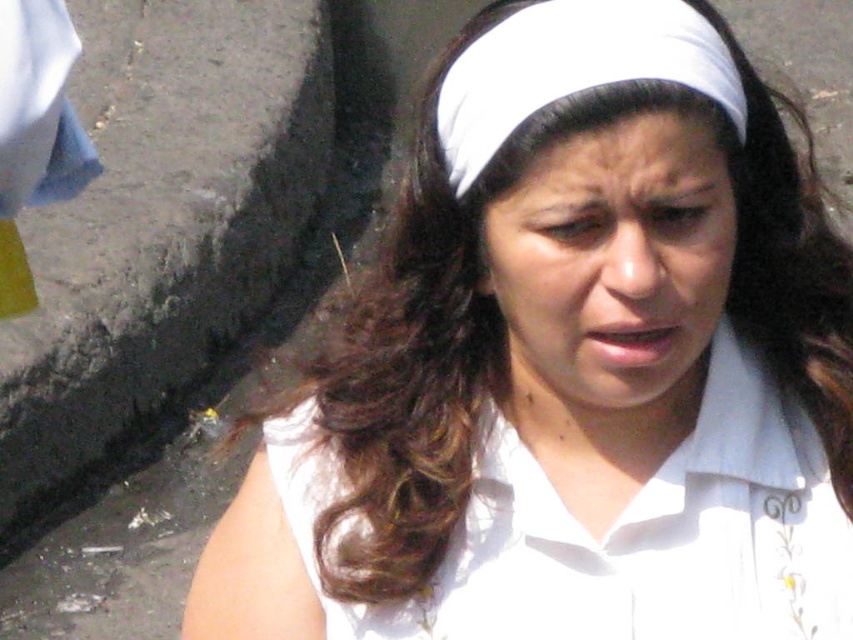
Who is higher up, asphalt at lower left or white cotton shirt at center?

asphalt at lower left is above.

Between point (167, 324) and point (619, 572), which one is positioned in front?

Positioned in front is point (619, 572).

Between point (186, 278) and point (753, 451), which one is positioned behind?

The point (186, 278) is behind.

You are a GUI agent. You are given a task and a screenshot of the screen. Output one action in this format:
    pyautogui.click(x=<x>, y=<y>)
    Task: Click on the asphalt at lower left
    
    Given the screenshot: What is the action you would take?
    pyautogui.click(x=161, y=221)

Can you confirm if white matte headband at center is shorter than white fabric headscarf at center?

No, white matte headband at center is not shorter than white fabric headscarf at center.

Between point (598, 202) and point (495, 52), which one is positioned in front?

Positioned in front is point (598, 202).

I want to click on white matte headband at center, so click(612, 266).

Can you confirm if asphalt at lower left is positioned to the left of white matte forehead at center?

Yes, asphalt at lower left is to the left of white matte forehead at center.

Does asphalt at lower left have a greater height compared to white matte forehead at center?

Yes.

Is point (131, 369) closer to viewer compared to point (521, 154)?

That is False.

At what (x,y) coordinates should I click in order to perform the action: click on asphalt at lower left. Please return your answer as a coordinate pair (x, y). This screenshot has height=640, width=853. Looking at the image, I should click on (161, 221).